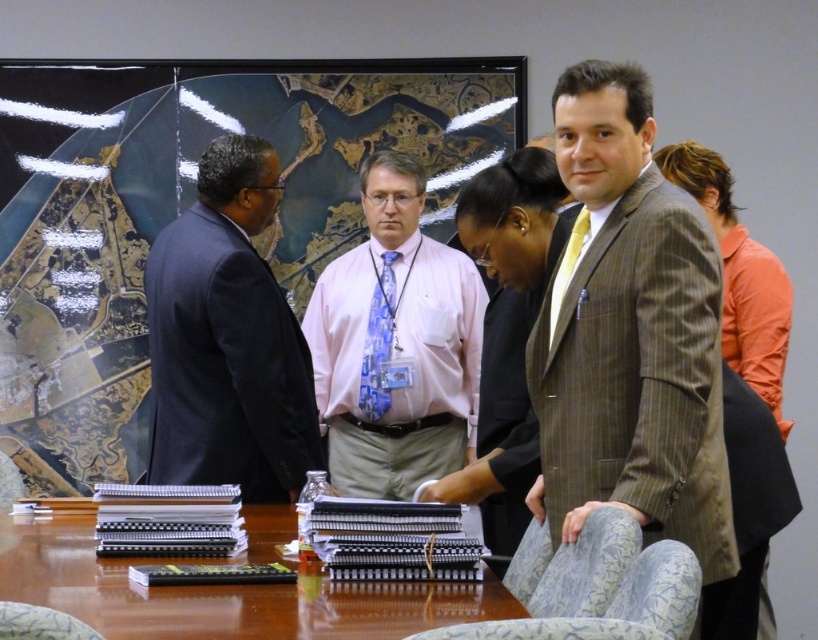
Question: Which object is the farthest from the yellow silk tie at center?

Choices:
 (A) blue printed tie at center
 (B) brown wooden table at center
 (C) dark blue suit at left
 (D) pink fabric shirt at center

Answer: (D)

Question: Can you confirm if brown pinstripe suit at center is smaller than blue printed tie at center?

Choices:
 (A) yes
 (B) no

Answer: (B)

Question: Considering the real-world distances, which object is closest to the pink fabric shirt at center?

Choices:
 (A) brown pinstripe suit at center
 (B) dark blue suit at left
 (C) brown wooden table at center
 (D) blue printed tie at center

Answer: (D)

Question: Can you confirm if brown pinstripe suit at center is thinner than brown wooden table at center?

Choices:
 (A) yes
 (B) no

Answer: (A)

Question: Is brown pinstripe suit at center to the left of pink fabric shirt at center from the viewer's perspective?

Choices:
 (A) yes
 (B) no

Answer: (B)

Question: Which point is closer to the camera?

Choices:
 (A) dark blue suit at left
 (B) brown wooden table at center
 (C) brown pinstripe suit at center

Answer: (B)